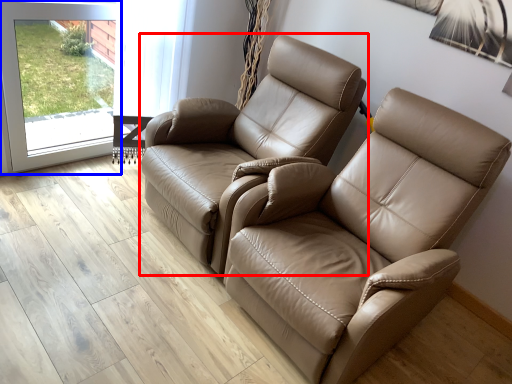
Question: Which of the following is the farthest to the observer, chair (highlighted by a red box) or screen door (highlighted by a blue box)?

Choices:
 (A) chair
 (B) screen door

Answer: (B)